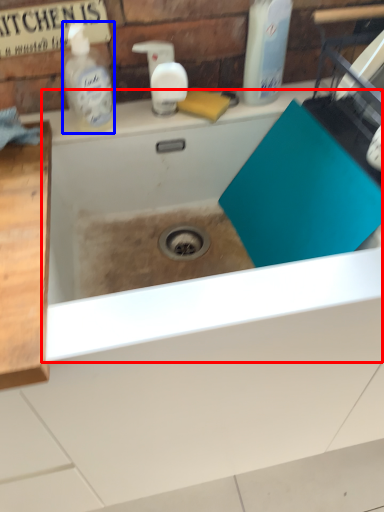
Question: Which point is closer to the camera, bath (highlighted by a red box) or cleaning product (highlighted by a blue box)?

Choices:
 (A) bath
 (B) cleaning product

Answer: (A)